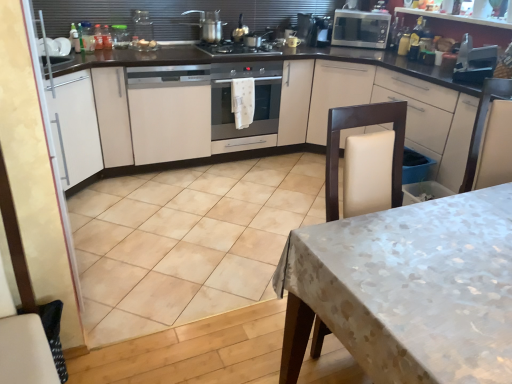
Question: Is metallic microwave at upper right, positioned as the 1th appliance in top-to-bottom order, closer to the viewer compared to metallic silver toaster at upper right, which appears as the first appliance when viewed from the front?

Choices:
 (A) yes
 (B) no

Answer: (B)

Question: Is metallic microwave at upper right, the 1th appliance in the left-to-right sequence, oriented towards metallic silver toaster at upper right, the second appliance from the top?

Choices:
 (A) no
 (B) yes

Answer: (B)

Question: From a real-world perspective, is metallic microwave at upper right, the 2th appliance ordered from the bottom, located beneath metallic silver toaster at upper right, which appears as the first appliance when viewed from the front?

Choices:
 (A) no
 (B) yes

Answer: (B)

Question: Does metallic microwave at upper right, which appears as the 2th appliance when viewed from the front, appear on the right side of metallic silver toaster at upper right, the second appliance from the top?

Choices:
 (A) yes
 (B) no

Answer: (B)

Question: Considering the relative positions of metallic microwave at upper right, the 2th appliance ordered from the bottom, and metallic silver toaster at upper right, placed as the first appliance when sorted from right to left, in the image provided, is metallic microwave at upper right, the 2th appliance ordered from the bottom, to the left of metallic silver toaster at upper right, placed as the first appliance when sorted from right to left, from the viewer's perspective?

Choices:
 (A) no
 (B) yes

Answer: (B)

Question: From the image's perspective, would you say metallic microwave at upper right, marked as the 2th appliance in a right-to-left arrangement, is shown under metallic silver toaster at upper right, which appears as the first appliance when viewed from the front?

Choices:
 (A) yes
 (B) no

Answer: (B)

Question: Is white matte cabinet at left, the first cabinetry viewed from the left, shorter than white textured tablecloth at lower right?

Choices:
 (A) yes
 (B) no

Answer: (B)

Question: From the image's perspective, is white matte cabinet at left, the third cabinetry viewed from the right, below white textured tablecloth at lower right?

Choices:
 (A) no
 (B) yes

Answer: (A)

Question: Can you confirm if white matte cabinet at left, the third cabinetry viewed from the right, is positioned to the left of white textured tablecloth at lower right?

Choices:
 (A) yes
 (B) no

Answer: (A)

Question: Is the position of white matte cabinet at left, the first cabinetry viewed from the left, more distant than that of white textured tablecloth at lower right?

Choices:
 (A) no
 (B) yes

Answer: (B)

Question: Is there a large distance between white matte cabinet at left, the third cabinetry viewed from the right, and white textured tablecloth at lower right?

Choices:
 (A) yes
 (B) no

Answer: (A)

Question: Is white matte cabinet at left, the first cabinetry viewed from the left, positioned with its back to white textured tablecloth at lower right?

Choices:
 (A) yes
 (B) no

Answer: (B)

Question: From the image's perspective, is satin silver oven at center under metallic microwave at upper right, marked as the 2th appliance in a right-to-left arrangement?

Choices:
 (A) no
 (B) yes

Answer: (B)